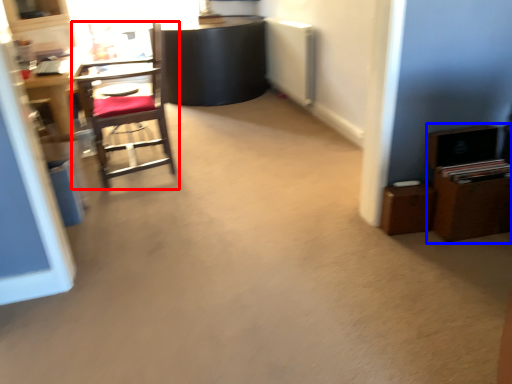
Question: Among these objects, which one is nearest to the camera, chair (highlighted by a red box) or dresser (highlighted by a blue box)?

Choices:
 (A) chair
 (B) dresser

Answer: (B)